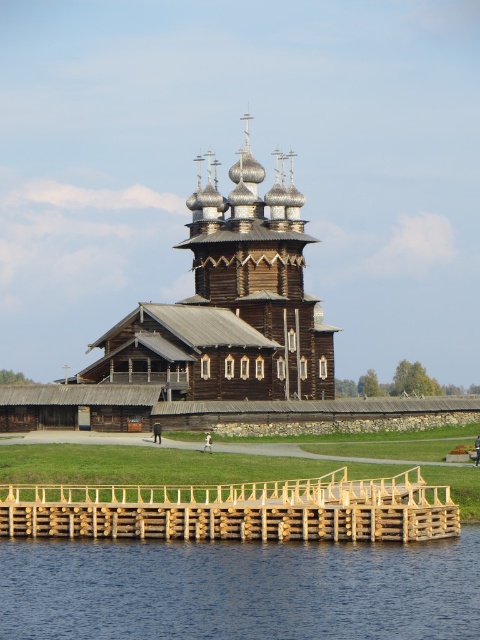
Does transparent water at lower center come in front of wooden church at center?

Yes, transparent water at lower center is closer to the viewer.

The width and height of the screenshot is (480, 640). What do you see at coordinates (240, 589) in the screenshot?
I see `transparent water at lower center` at bounding box center [240, 589].

Image resolution: width=480 pixels, height=640 pixels. Find the location of `transparent water at lower center`. transparent water at lower center is located at coordinates (240, 589).